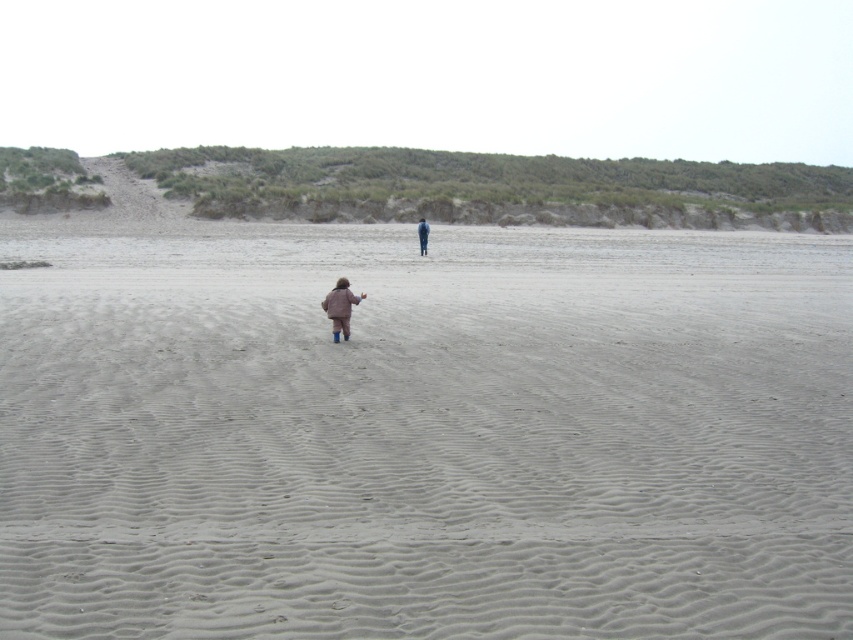
Question: Is smooth sand at center below denim jacket at center?

Choices:
 (A) yes
 (B) no

Answer: (A)

Question: Can you confirm if smooth sand at center is bigger than denim jacket at center?

Choices:
 (A) no
 (B) yes

Answer: (B)

Question: Among these points, which one is farthest from the camera?

Choices:
 (A) (337, 300)
 (B) (474, 394)
 (C) (428, 230)

Answer: (C)

Question: Which point is closer to the camera taking this photo?

Choices:
 (A) (780, 300)
 (B) (422, 243)
 (C) (344, 294)

Answer: (C)

Question: Which of these objects is positioned farthest from the smooth sand at center?

Choices:
 (A) matte brown coat at lower center
 (B) denim jacket at center

Answer: (B)

Question: Is smooth sand at center below matte brown coat at lower center?

Choices:
 (A) no
 (B) yes

Answer: (A)